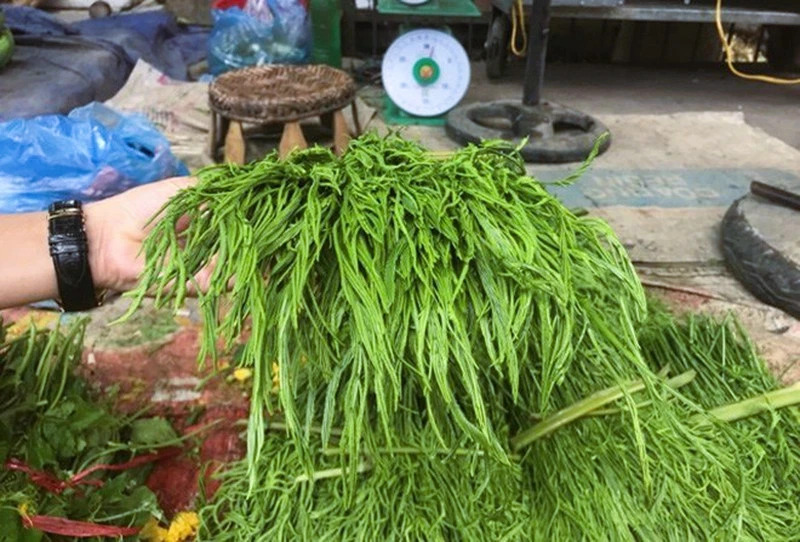
This screenshot has width=800, height=542. I want to click on metal shelf, so click(x=673, y=9).